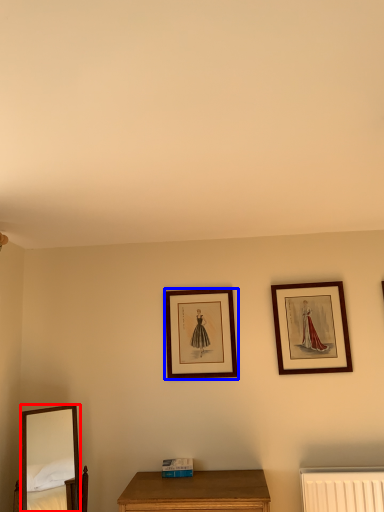
Question: Among these objects, which one is nearest to the camera, mirror (highlighted by a red box) or picture frame (highlighted by a blue box)?

Choices:
 (A) mirror
 (B) picture frame

Answer: (A)